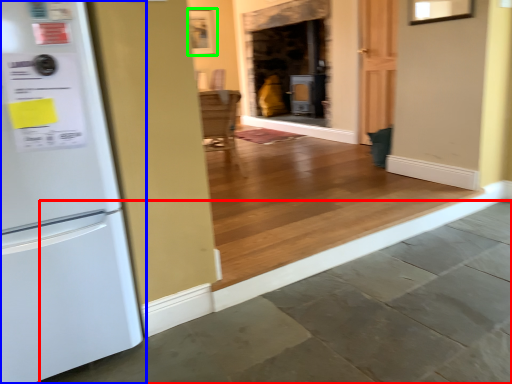
Question: Considering the real-world distances, which object is farthest from concrete (highlighted by a red box)? refrigerator (highlighted by a blue box) or picture frame (highlighted by a green box)?

Choices:
 (A) refrigerator
 (B) picture frame

Answer: (B)